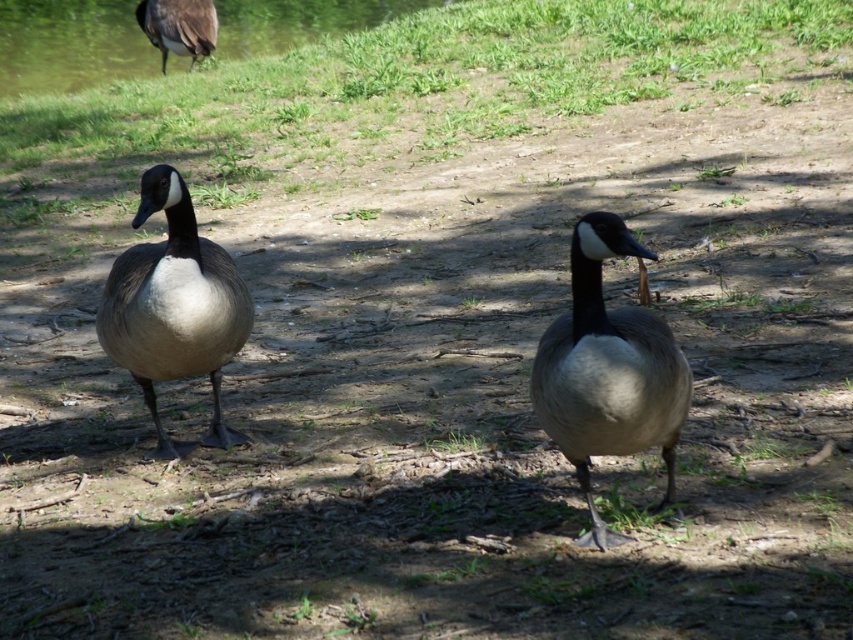
Who is higher up, green grass at upper center or matte gray goose at center?

green grass at upper center

Is green grass at upper center to the right of matte gray goose at center from the viewer's perspective?

In fact, green grass at upper center is to the left of matte gray goose at center.

Which is behind, point (627, 76) or point (529, 385)?

Point (627, 76)

At what (x,y) coordinates should I click in order to perform the action: click on green grass at upper center. Please return your answer as a coordinate pair (x, y). The width and height of the screenshot is (853, 640). Looking at the image, I should click on pos(433,76).

Can you confirm if matte gray goose at center is shorter than gray matte goose at left?

Yes.

The image size is (853, 640). Identify the location of matte gray goose at center. (608, 371).

Does gray matte goose at left appear on the right side of green grass at upper left?

Indeed, gray matte goose at left is positioned on the right side of green grass at upper left.

Which is behind, point (138, 278) or point (322, 26)?

Positioned behind is point (322, 26).

At what (x,y) coordinates should I click in order to perform the action: click on gray matte goose at left. Please return your answer as a coordinate pair (x, y). Image resolution: width=853 pixels, height=640 pixels. Looking at the image, I should click on (173, 305).